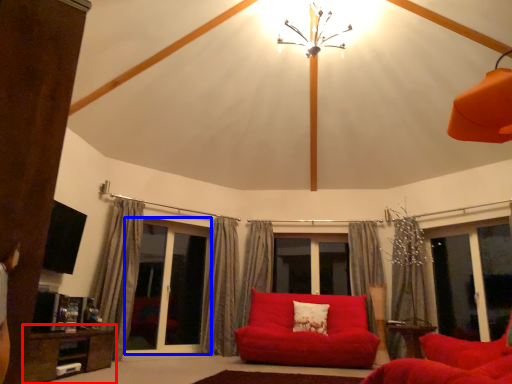
Question: Among these objects, which one is nearest to the camera, table (highlighted by a red box) or screen door (highlighted by a blue box)?

Choices:
 (A) table
 (B) screen door

Answer: (A)